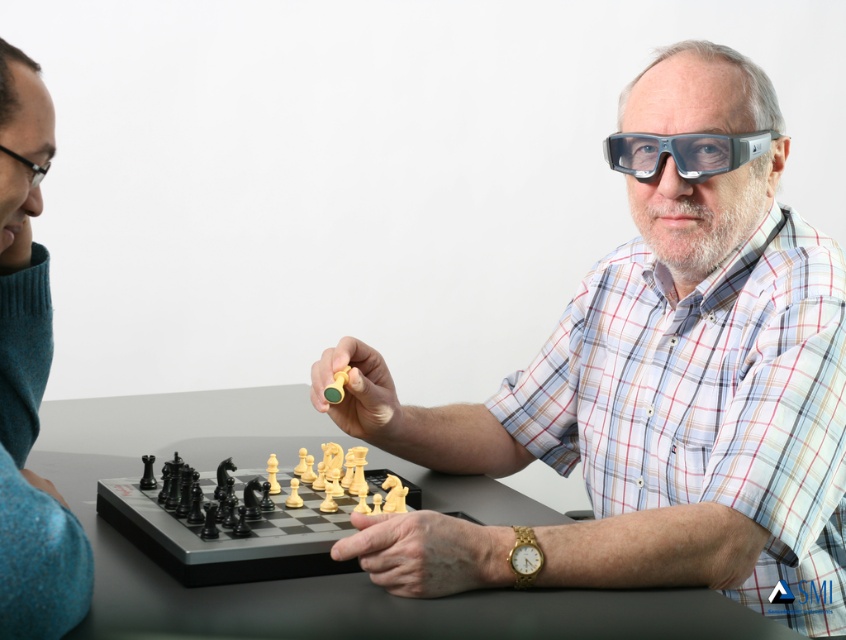
You are a chess player who wants to place both the black plastic chess pieces at center and the transparent plastic goggles at center on a shelf. The shelf has a width of 10 cm. Can you fit both items side by side?

The black plastic chess pieces at center are larger in width than the transparent plastic goggles at center. Since the shelf is only 10 cm wide, it depends on the exact dimensions of both items. If the combined width of both items exceeds 10 cm, they won

Is the point at coordinates (339,529) closer to the camera than 40 inches?

Yes, the point at coordinates (339,529) is 38.60 inches from the camera, which is closer than 40 inches.

Based on the photo, you are a visitor observing the chess game. You notice the teal wool sweater at left and the transparent plastic goggles at center. Which object is taller?

The teal wool sweater at left is much taller than the transparent plastic goggles at center.